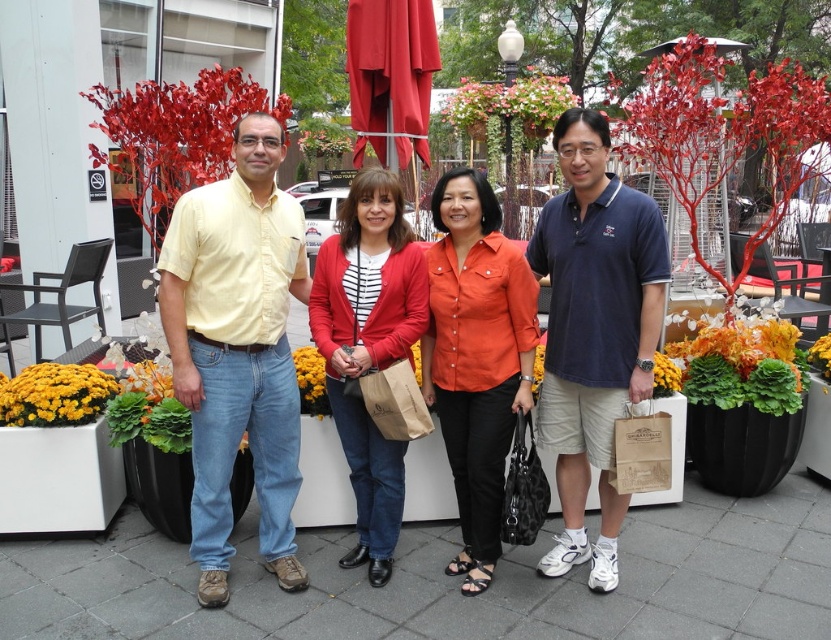
How distant is blue cotton polo shirt at center from yellow fabric flower at center?

blue cotton polo shirt at center and yellow fabric flower at center are 40.28 centimeters apart from each other.

Can you confirm if blue cotton polo shirt at center is smaller than yellow fabric flower at center?

No, blue cotton polo shirt at center is not smaller than yellow fabric flower at center.

Is point (538, 248) closer to viewer compared to point (539, 371)?

Yes.

At what (x,y) coordinates should I click in order to perform the action: click on blue cotton polo shirt at center. Please return your answer as a coordinate pair (x, y). This screenshot has width=831, height=640. Looking at the image, I should click on (x=593, y=332).

Is point (657, 362) positioned before point (824, 372)?

Yes, point (657, 362) is in front of point (824, 372).

Does yellow matte flower at center have a smaller size compared to green leafy plant at center?

Yes.

Is point (670, 369) positioned before point (820, 356)?

Yes, point (670, 369) is closer to viewer.

Where is `yellow matte flower at center`? The width and height of the screenshot is (831, 640). yellow matte flower at center is located at coordinates (665, 376).

Does floral arrangement at center appear under green leafy plant at center?

Actually, floral arrangement at center is above green leafy plant at center.

Does floral arrangement at center come behind green leafy plant at center?

Yes, floral arrangement at center is further from the viewer.

Locate an element on the screen. floral arrangement at center is located at coordinates (510, 99).